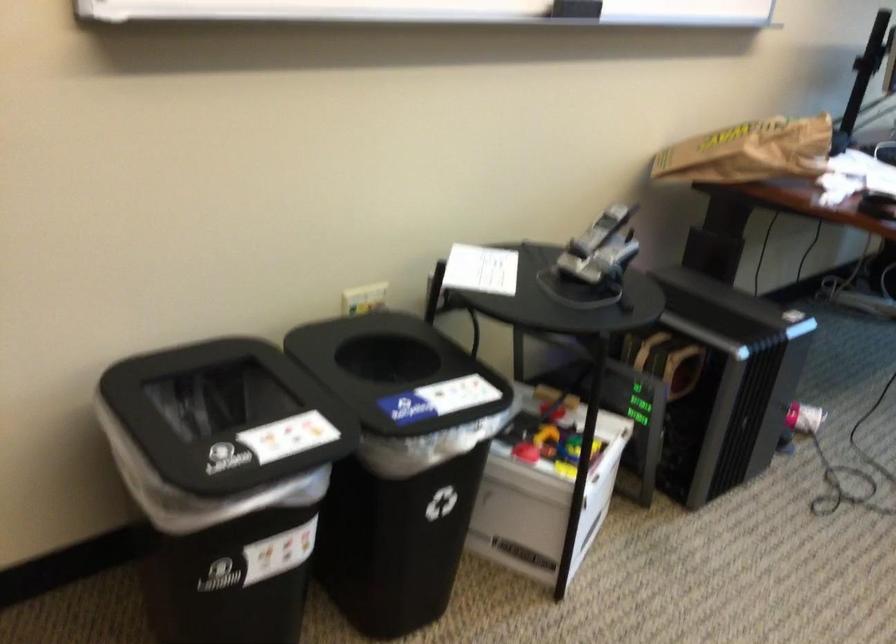
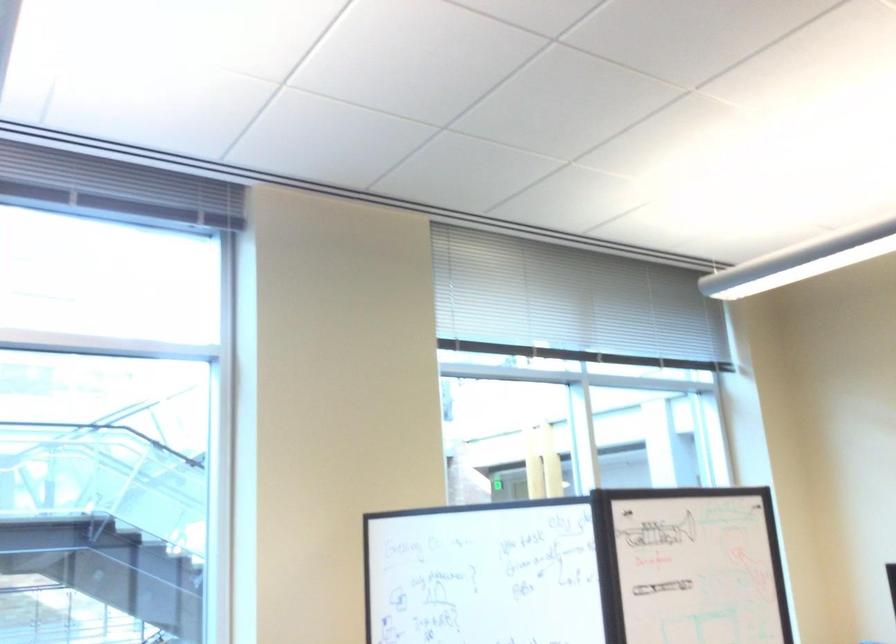
Based on the continuous images, in which direction is the camera rotating?

The camera rotated toward right-up.